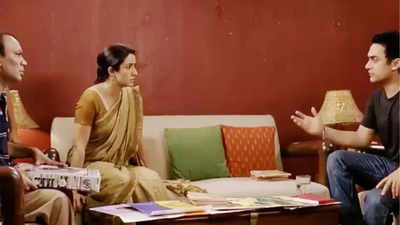
Where is `end table`? end table is located at coordinates (313, 146).